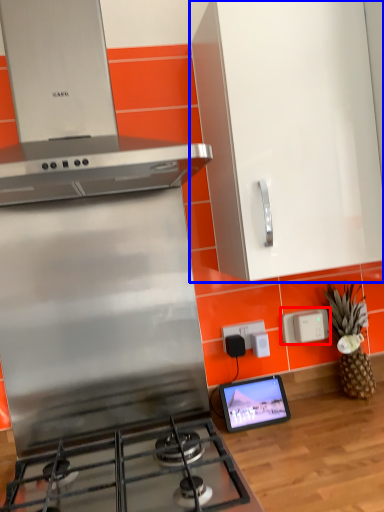
Question: Which of the following is the closest to the observer, electric outlet (highlighted by a red box) or cabinetry (highlighted by a blue box)?

Choices:
 (A) electric outlet
 (B) cabinetry

Answer: (B)